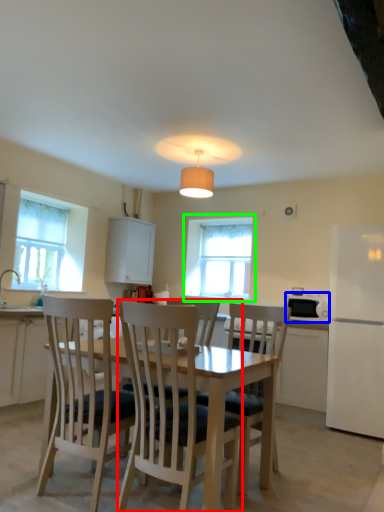
Question: Considering the real-world distances, which object is closest to chair (highlighted by a red box)? appliance (highlighted by a blue box) or window (highlighted by a green box).

Choices:
 (A) appliance
 (B) window

Answer: (A)